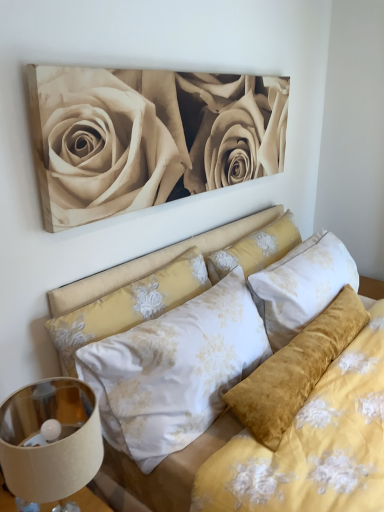
Question: Is the depth of beige matte/soft canvas at upper center greater than that of velvet yellow pillow at center, which is the 1th pillow from right to left?

Choices:
 (A) no
 (B) yes

Answer: (A)

Question: Is beige matte/soft canvas at upper center at the right side of velvet yellow pillow at center, the second pillow in the left-to-right sequence?

Choices:
 (A) yes
 (B) no

Answer: (B)

Question: Is beige matte/soft canvas at upper center smaller than velvet yellow pillow at center, which is the 1th pillow from right to left?

Choices:
 (A) no
 (B) yes

Answer: (A)

Question: From a real-world perspective, is beige matte/soft canvas at upper center positioned under velvet yellow pillow at center, the second pillow in the left-to-right sequence, based on gravity?

Choices:
 (A) yes
 (B) no

Answer: (B)

Question: Is beige matte/soft canvas at upper center next to velvet yellow pillow at center, the second pillow in the left-to-right sequence?

Choices:
 (A) yes
 (B) no

Answer: (B)

Question: Is beige matte/soft canvas at upper center inside or outside of metallic beige lampshade at lower left?

Choices:
 (A) outside
 (B) inside

Answer: (A)

Question: Is beige matte/soft canvas at upper center wider or thinner than metallic beige lampshade at lower left?

Choices:
 (A) wide
 (B) thin

Answer: (B)

Question: Is point (99, 206) positioned closer to the camera than point (21, 401)?

Choices:
 (A) farther
 (B) closer

Answer: (A)

Question: Considering their positions, is beige matte/soft canvas at upper center located in front of or behind metallic beige lampshade at lower left?

Choices:
 (A) front
 (B) behind

Answer: (B)

Question: In terms of height, does velvet yellow pillow at center, which is the 1th pillow from right to left, look taller or shorter compared to beige matte/soft canvas at upper center?

Choices:
 (A) short
 (B) tall

Answer: (A)

Question: Considering the positions of velvet yellow pillow at center, the second pillow in the left-to-right sequence, and beige matte/soft canvas at upper center in the image, is velvet yellow pillow at center, the second pillow in the left-to-right sequence, wider or thinner than beige matte/soft canvas at upper center?

Choices:
 (A) wide
 (B) thin

Answer: (A)

Question: From a real-world perspective, is velvet yellow pillow at center, which is the 1th pillow from right to left, physically located above or below beige matte/soft canvas at upper center?

Choices:
 (A) above
 (B) below

Answer: (B)

Question: In terms of size, does velvet yellow pillow at center, the second pillow in the left-to-right sequence, appear bigger or smaller than beige matte/soft canvas at upper center?

Choices:
 (A) small
 (B) big

Answer: (A)

Question: Considering the relative positions of velvet yellow pillow at center, the second pillow in the left-to-right sequence, and metallic beige lampshade at lower left in the image provided, is velvet yellow pillow at center, the second pillow in the left-to-right sequence, to the left or to the right of metallic beige lampshade at lower left?

Choices:
 (A) right
 (B) left

Answer: (A)

Question: Considering the positions of velvet yellow pillow at center, the second pillow in the left-to-right sequence, and metallic beige lampshade at lower left in the image, is velvet yellow pillow at center, the second pillow in the left-to-right sequence, wider or thinner than metallic beige lampshade at lower left?

Choices:
 (A) thin
 (B) wide

Answer: (A)